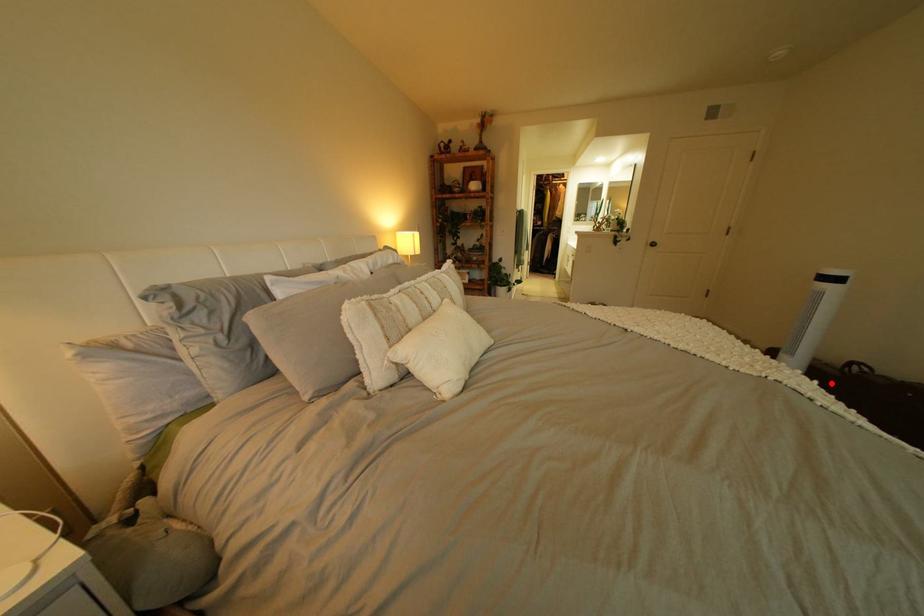
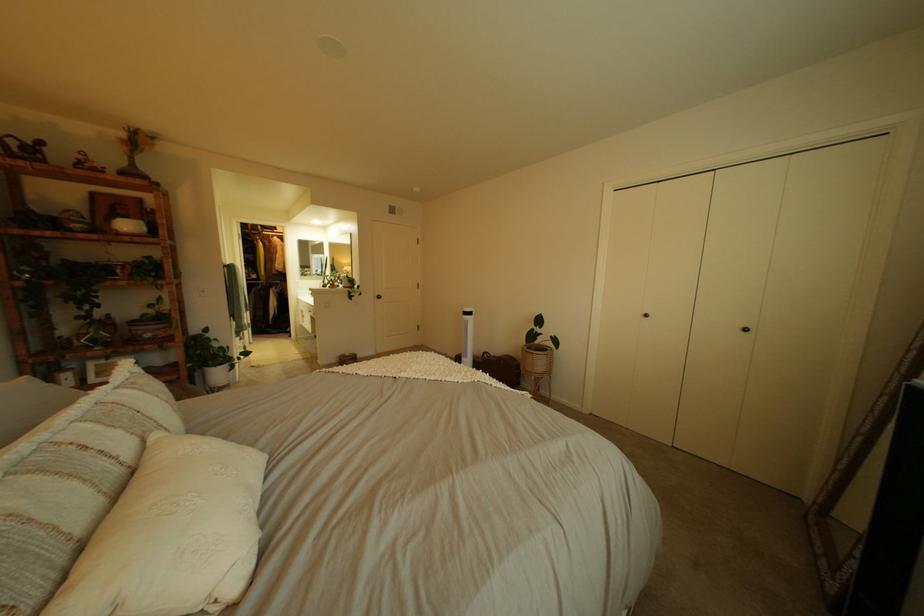
In the second image, find the point that corresponds to the highlighted location in the first image.

(504, 376)